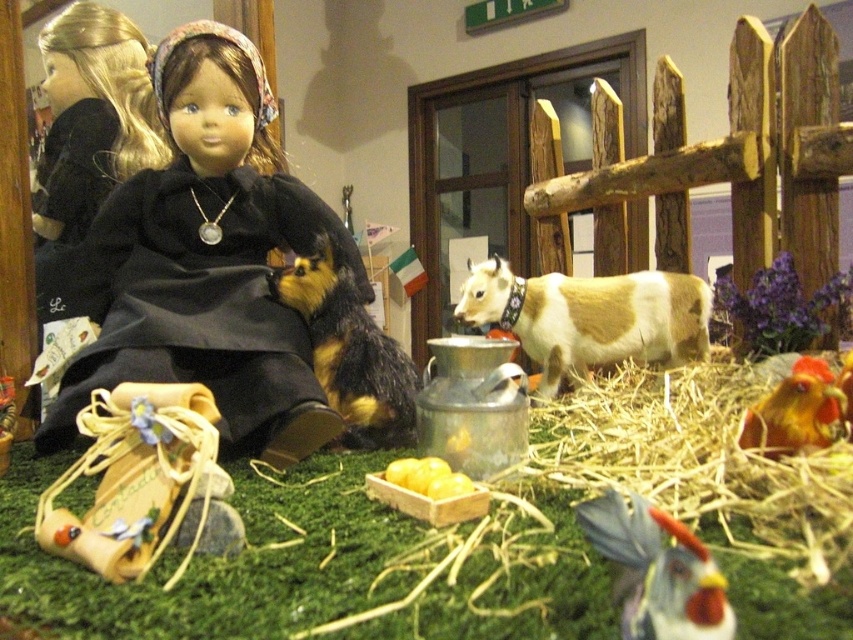
Looking at this image, you are a toy collector who wants to display both the matte black dress at center and the light brown and white plastic cow at center on a shelf. The shelf has a height limit of 15 cm. Can both items fit vertically on the shelf without exceeding the height limit?

The matte black dress at center has a larger size compared to light brown and white plastic cow at center. However, since the height limit is 15 cm and the exact heights of the items are not provided, it is impossible to determine if both will fit vertically without exceeding the height limit.

Looking at this image, you are a farmer looking at this miniature farm scene. You notice the matte black dress at center and the light brown and white plastic cow at center. Which object is positioned higher in the image?

The matte black dress at center is above the light brown and white plastic cow at center, so the matte black dress at center is positioned higher in the image.